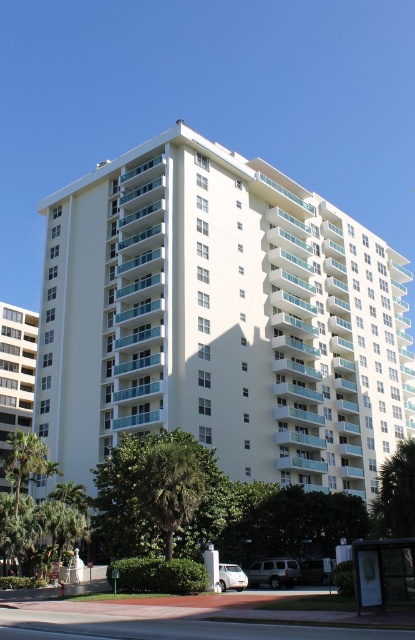
Based on the photo, you are standing at the base of the white smooth building at center and want to reach the metallic silver bus stop at lower right. Which direction should you walk to get there?

The metallic silver bus stop at lower right is located below the white smooth building at center, so you should walk downward or towards the lower part of the building to reach it.

You are standing in front of the residential building and notice a green leafy palm tree at lower center and a white concrete building at left. Which object takes up more area in the scene?

The white concrete building at left takes up more area in the scene than the green leafy palm tree at lower center.

You are standing in front of the modern residential building and notice a green leafy palm tree at lower center and a white concrete building at left. Which object is closer to you based on their positions in the image?

The green leafy palm tree at lower center is closer to you because it is positioned over the white concrete building at left, indicating it is in front.